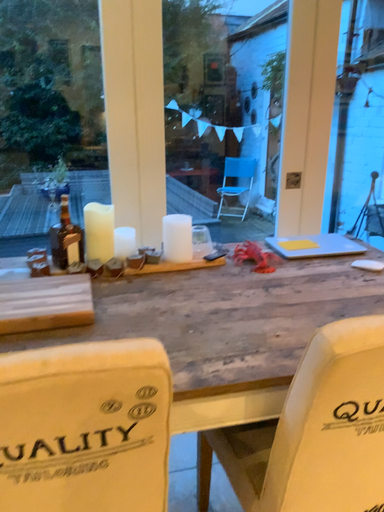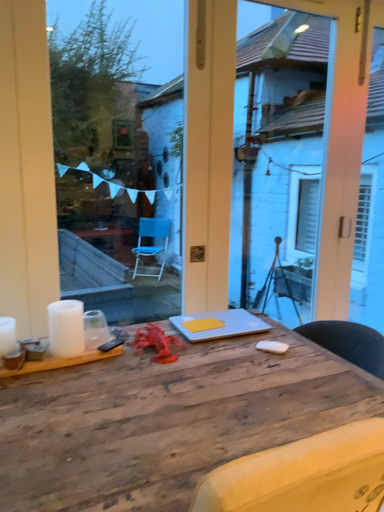
Question: How did the camera likely rotate when shooting the video?

Choices:
 (A) rotated downward
 (B) rotated upward

Answer: (B)